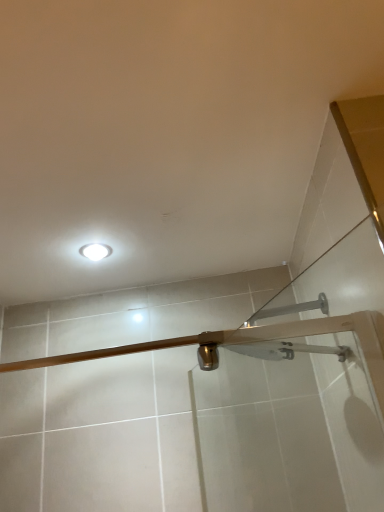
What do you see at coordinates (95, 251) in the screenshot? The height and width of the screenshot is (512, 384). I see `white glossy light fixture at upper center` at bounding box center [95, 251].

Find the location of a particular element. Image resolution: width=384 pixels, height=512 pixels. white glossy light fixture at upper center is located at coordinates (95, 251).

The image size is (384, 512). I want to click on white glossy light fixture at upper center, so click(x=95, y=251).